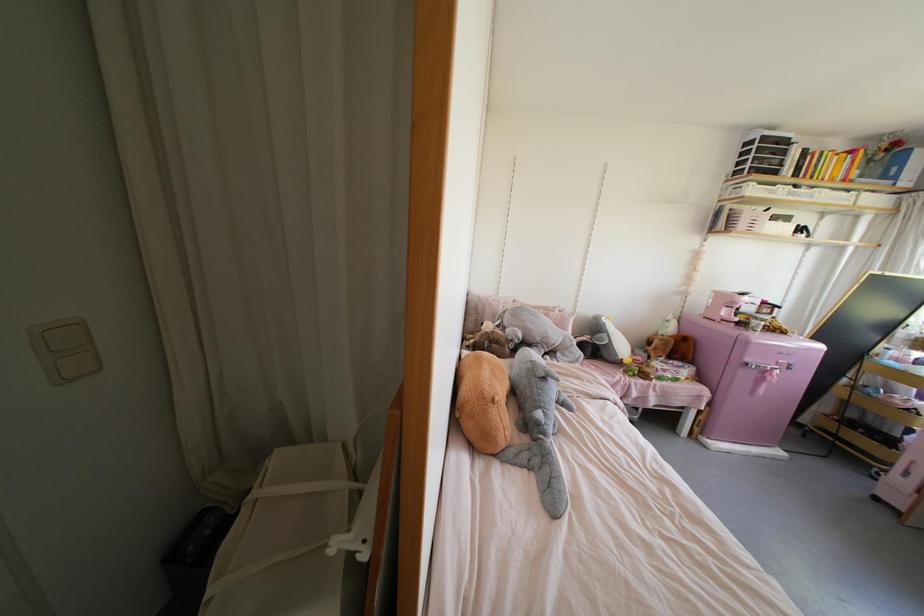
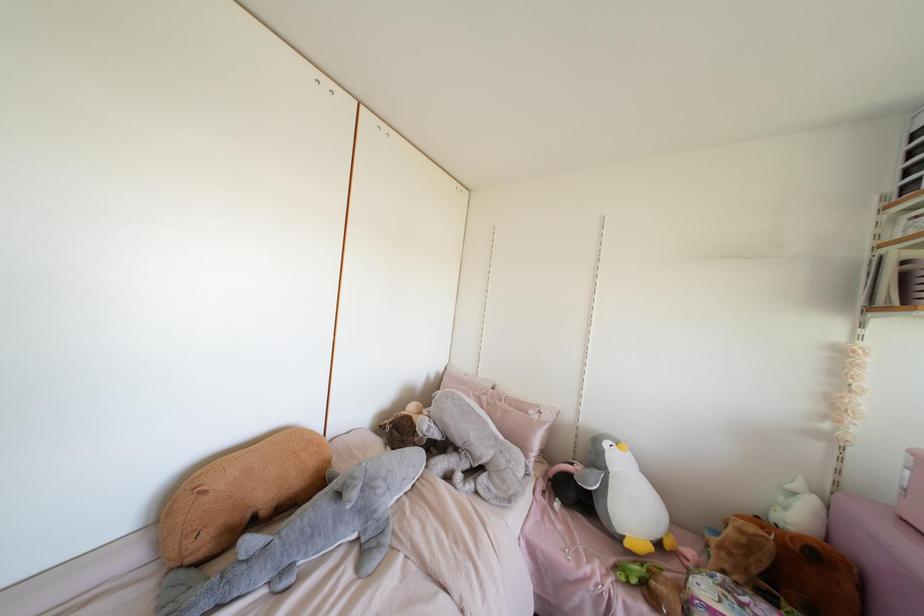
In the second image, find the point that corresponds to (x=710, y=231) in the first image.

(870, 307)